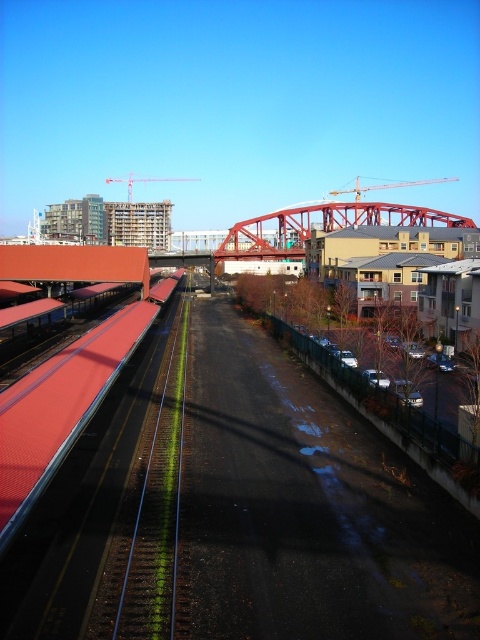
Question: Which point is farther to the camera?

Choices:
 (A) smooth red platform at left
 (B) metallic red bridge at center
 (C) metallic construction crane at upper center

Answer: (C)

Question: Which of the following is the closest to the observer?

Choices:
 (A) metallic red crane at upper center
 (B) metallic red bridge at center
 (C) smooth red platform at left

Answer: (C)

Question: Estimate the real-world distances between objects in this image. Which object is farther from the metallic construction crane at upper center?

Choices:
 (A) metallic red bridge at center
 (B) smooth red platform at left
 (C) metallic red crane at upper center

Answer: (B)

Question: Does metallic red crane at upper center appear on the left side of metallic construction crane at upper center?

Choices:
 (A) no
 (B) yes

Answer: (A)

Question: Considering the relative positions of metallic red crane at upper center and metallic construction crane at upper center in the image provided, where is metallic red crane at upper center located with respect to metallic construction crane at upper center?

Choices:
 (A) left
 (B) right

Answer: (B)

Question: Is smooth red platform at left thinner than metallic construction crane at upper center?

Choices:
 (A) no
 (B) yes

Answer: (B)